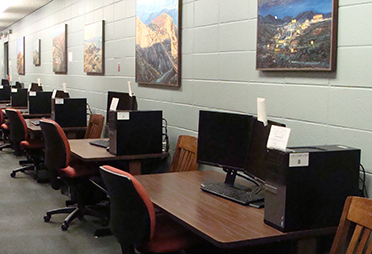
Identify the location of keyboard. The width and height of the screenshot is (372, 254). (224, 190), (102, 141).